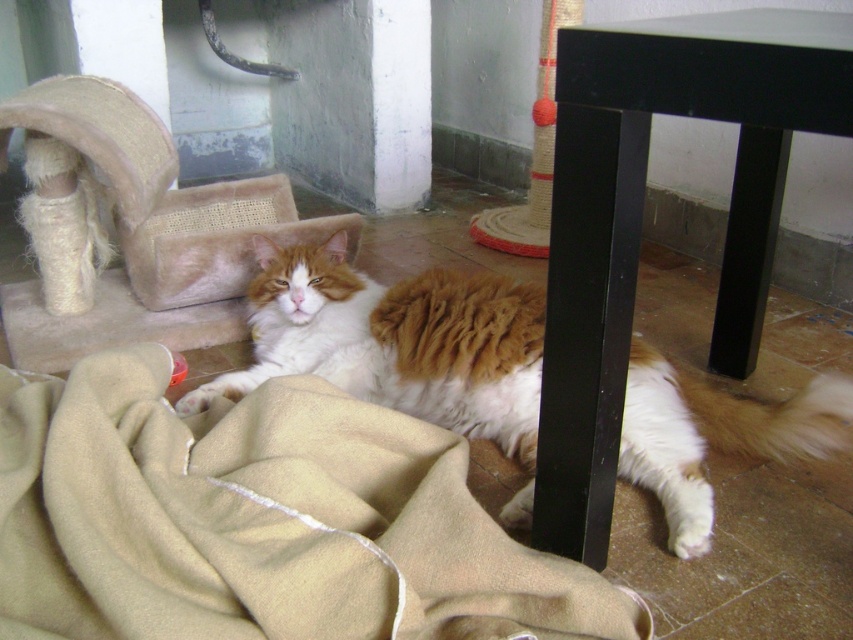
Question: Can you confirm if beige woolen blanket at lower left is thinner than fuzzy orange-white cat at center?

Choices:
 (A) yes
 (B) no

Answer: (A)

Question: Estimate the real-world distances between objects in this image. Which object is farther from the beige woolen blanket at lower left?

Choices:
 (A) fuzzy orange-white cat at center
 (B) black glossy table at lower right

Answer: (B)

Question: Is black glossy table at lower right above sisal-covered cat bed at upper left?

Choices:
 (A) no
 (B) yes

Answer: (A)

Question: From the image, what is the correct spatial relationship of black glossy table at lower right in relation to fuzzy orange-white cat at center?

Choices:
 (A) below
 (B) above

Answer: (B)

Question: Which point appears closest to the camera in this image?

Choices:
 (A) (126, 216)
 (B) (605, 426)
 (C) (503, 435)

Answer: (B)

Question: Which point appears farthest from the camera in this image?

Choices:
 (A) pos(828,45)
 (B) pos(492,385)
 (C) pos(479,564)

Answer: (B)